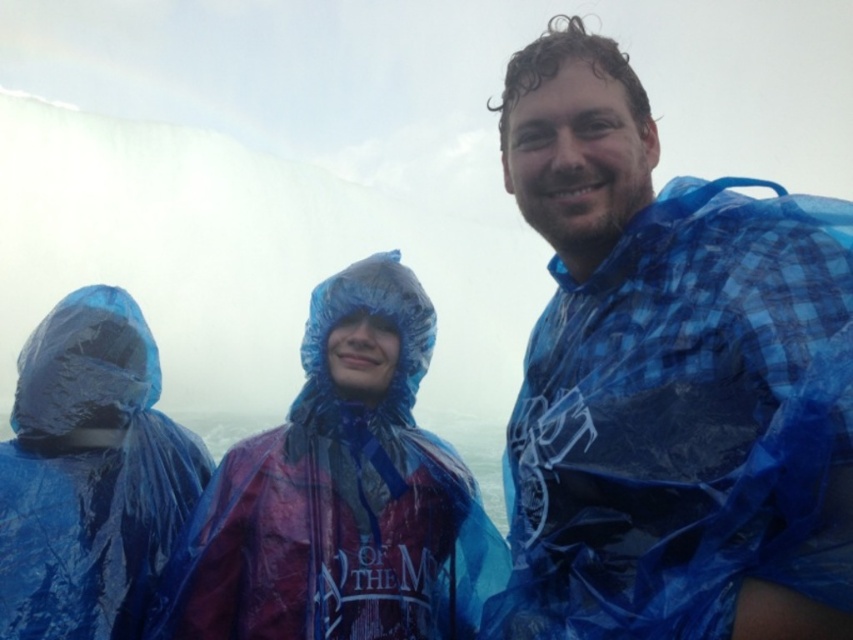
Question: Which point is closer to the camera?

Choices:
 (A) transparent plastic raincoat at center
 (B) blue plastic raincoat at center
 (C) blue plastic raincoat at left

Answer: (B)

Question: From the image, what is the correct spatial relationship of blue plastic raincoat at center in relation to transparent plastic raincoat at center?

Choices:
 (A) above
 (B) below

Answer: (A)

Question: Which point is closer to the camera?

Choices:
 (A) (57, 486)
 (B) (784, 252)
 (C) (199, 616)

Answer: (B)

Question: Considering the relative positions of blue plastic raincoat at center and blue plastic raincoat at left in the image provided, where is blue plastic raincoat at center located with respect to blue plastic raincoat at left?

Choices:
 (A) below
 (B) above

Answer: (B)

Question: From the image, what is the correct spatial relationship of blue plastic raincoat at center in relation to blue plastic raincoat at left?

Choices:
 (A) left
 (B) right

Answer: (B)

Question: Which of the following is the farthest from the observer?

Choices:
 (A) blue plastic raincoat at center
 (B) blue plastic raincoat at left

Answer: (B)